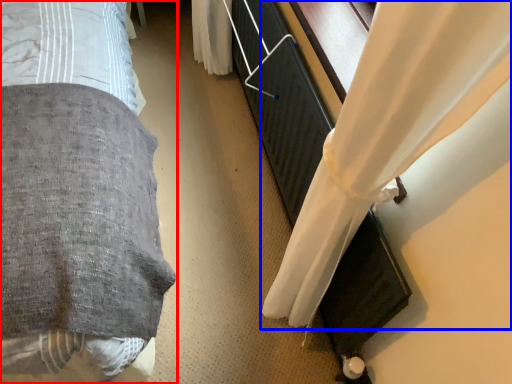
Question: Which object is closer to the camera taking this photo, bed (highlighted by a red box) or curtain (highlighted by a blue box)?

Choices:
 (A) bed
 (B) curtain

Answer: (A)